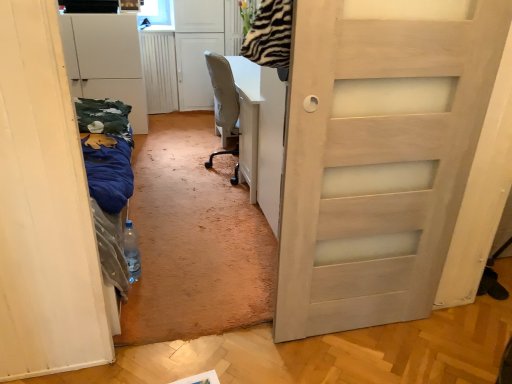
Question: From a real-world perspective, is translucent plastic bottle at center located beneath white matte door at left?

Choices:
 (A) no
 (B) yes

Answer: (B)

Question: Is translucent plastic bottle at center at the right side of white matte door at left?

Choices:
 (A) no
 (B) yes

Answer: (B)

Question: Is translucent plastic bottle at center closer to the viewer compared to white matte door at left?

Choices:
 (A) yes
 (B) no

Answer: (B)

Question: Is the surface of translucent plastic bottle at center in direct contact with white matte door at left?

Choices:
 (A) yes
 (B) no

Answer: (B)

Question: Could you tell me if translucent plastic bottle at center is facing white matte door at left?

Choices:
 (A) yes
 (B) no

Answer: (A)

Question: Relative to white matte door at left, is translucent plastic bottle at center in front or behind?

Choices:
 (A) front
 (B) behind

Answer: (B)

Question: Considering the relative positions of translucent plastic bottle at center and white matte door at left in the image provided, is translucent plastic bottle at center to the left or to the right of white matte door at left?

Choices:
 (A) right
 (B) left

Answer: (A)

Question: Is point (132, 243) positioned closer to the camera than point (35, 302)?

Choices:
 (A) closer
 (B) farther

Answer: (B)

Question: From the image's perspective, is translucent plastic bottle at center positioned above or below white matte door at left?

Choices:
 (A) above
 (B) below

Answer: (B)

Question: Looking at their shapes, would you say white matte door at left is wider or thinner than white matte cabinet at left?

Choices:
 (A) thin
 (B) wide

Answer: (B)

Question: In terms of size, does white matte door at left appear bigger or smaller than white matte cabinet at left?

Choices:
 (A) big
 (B) small

Answer: (A)

Question: Is white matte door at left inside or outside of white matte cabinet at left?

Choices:
 (A) outside
 (B) inside

Answer: (A)

Question: Is point (27, 152) closer or farther from the camera than point (79, 31)?

Choices:
 (A) closer
 (B) farther

Answer: (A)

Question: Considering the positions of white matte cabinet at left and translucent plastic bottle at center in the image, is white matte cabinet at left taller or shorter than translucent plastic bottle at center?

Choices:
 (A) short
 (B) tall

Answer: (B)

Question: Does point (91, 87) appear closer or farther from the camera than point (123, 233)?

Choices:
 (A) closer
 (B) farther

Answer: (B)